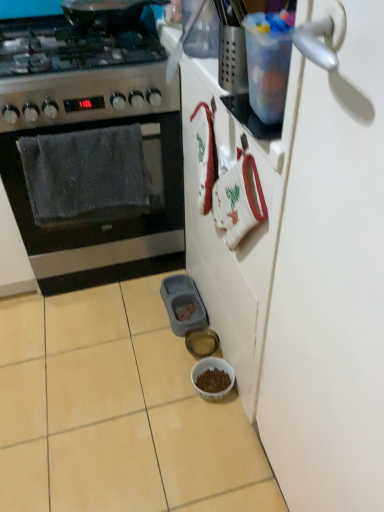
Question: Can you confirm if stainless steel gas stove at left is thinner than gray plastic pet food container at lower center?

Choices:
 (A) yes
 (B) no

Answer: (B)

Question: Considering the relative sizes of stainless steel gas stove at left and gray plastic pet food container at lower center in the image provided, is stainless steel gas stove at left taller than gray plastic pet food container at lower center?

Choices:
 (A) yes
 (B) no

Answer: (A)

Question: Can you confirm if stainless steel gas stove at left is wider than gray plastic pet food container at lower center?

Choices:
 (A) yes
 (B) no

Answer: (A)

Question: Can you confirm if stainless steel gas stove at left is bigger than gray plastic pet food container at lower center?

Choices:
 (A) no
 (B) yes

Answer: (B)

Question: Is stainless steel gas stove at left far from gray plastic pet food container at lower center?

Choices:
 (A) no
 (B) yes

Answer: (A)

Question: From a real-world perspective, does stainless steel gas stove at left sit lower than gray plastic pet food container at lower center?

Choices:
 (A) yes
 (B) no

Answer: (B)

Question: Does stainless steel oven at left appear on the right side of translucent glass bowl at lower center, the first bowl from the back?

Choices:
 (A) yes
 (B) no

Answer: (B)

Question: From the image's perspective, is stainless steel oven at left over translucent glass bowl at lower center, the first bowl from the back?

Choices:
 (A) yes
 (B) no

Answer: (A)

Question: From a real-world perspective, is stainless steel oven at left positioned under translucent glass bowl at lower center, the first bowl from the back, based on gravity?

Choices:
 (A) yes
 (B) no

Answer: (B)

Question: Is stainless steel oven at left next to translucent glass bowl at lower center, the 2th bowl in the front-to-back sequence, and touching it?

Choices:
 (A) no
 (B) yes

Answer: (A)

Question: Is stainless steel oven at left taller than translucent glass bowl at lower center, the 2th bowl in the front-to-back sequence?

Choices:
 (A) no
 (B) yes

Answer: (B)

Question: From a real-world perspective, is stainless steel oven at left on top of translucent glass bowl at lower center, the first bowl from the back?

Choices:
 (A) no
 (B) yes

Answer: (B)

Question: Is translucent glass bowl at lower center, the 2th bowl in the front-to-back sequence, aimed at stainless steel oven at left?

Choices:
 (A) no
 (B) yes

Answer: (A)